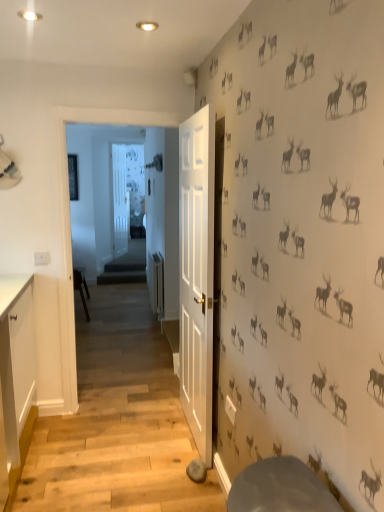
Question: Is point (18, 392) positioned closer to the camera than point (112, 205)?

Choices:
 (A) farther
 (B) closer

Answer: (B)

Question: Relative to white wooden door at center, is white glossy cabinet at left in front or behind?

Choices:
 (A) front
 (B) behind

Answer: (A)

Question: Based on their sizes in the image, would you say white glossy cabinet at left is bigger or smaller than white wooden door at center?

Choices:
 (A) big
 (B) small

Answer: (A)

Question: Considering their positions, is white wooden door at center located in front of or behind white glossy cabinet at left?

Choices:
 (A) front
 (B) behind

Answer: (B)

Question: Would you say white wooden door at center is inside or outside white glossy cabinet at left?

Choices:
 (A) outside
 (B) inside

Answer: (A)

Question: Considering the positions of white wooden door at center and white glossy cabinet at left in the image, is white wooden door at center bigger or smaller than white glossy cabinet at left?

Choices:
 (A) big
 (B) small

Answer: (B)

Question: From the image's perspective, relative to white glossy cabinet at left, is white wooden door at center above or below?

Choices:
 (A) below
 (B) above

Answer: (B)